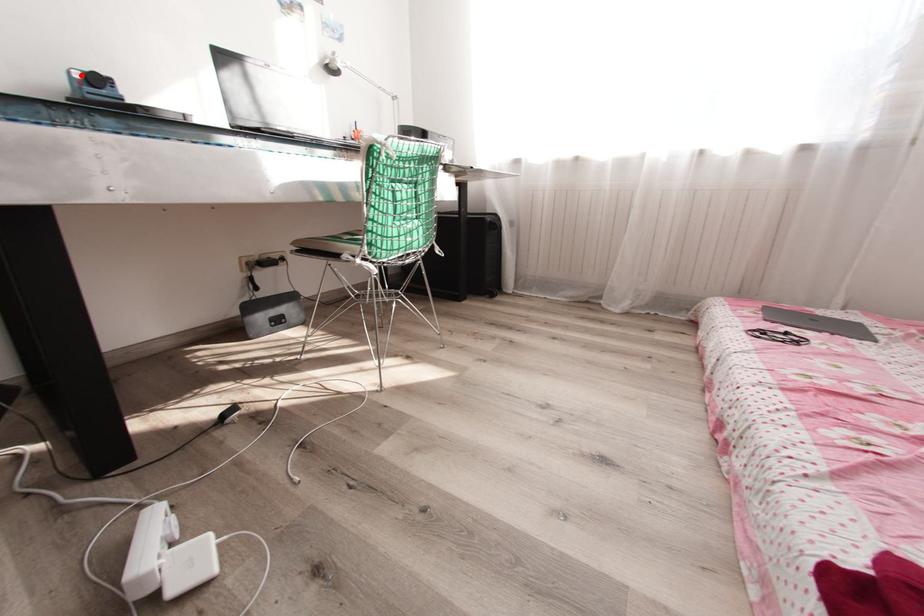
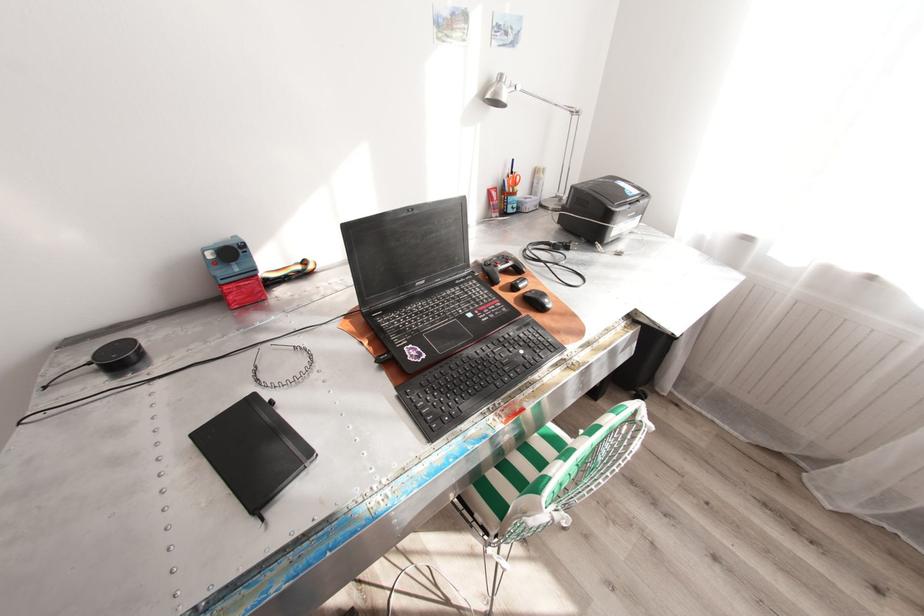
Question: I am providing you with two images of the same scene from different viewpoints. A red point is marked on the first image. At the location where the point appears in image 1, is it still visible in image 2?

Choices:
 (A) Yes
 (B) No

Answer: (A)